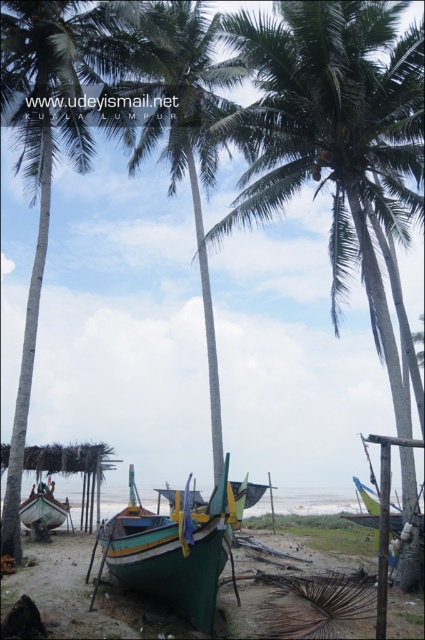
You are a photographer standing at the green leafy palm tree at center and want to take a photo of the green matte boat at center. If your camera can focus on objects up to 10 meters away, will you be able to capture the boat clearly?

The distance between the green leafy palm tree at center and the green matte boat at center is 9.79 meters, which is within the camera focus range of up to 10 meters. Therefore, you can capture the boat clearly.

You are an artist planning to paint this coastal scene. You want to ensure the green leafy coconut tree at center and the green fabric boat at lower right are proportionally accurate. Which object should you paint larger?

The green leafy coconut tree at center should be painted larger because it has a larger size compared to the green fabric boat at lower right.

You are standing at the center of the image and want to walk towards the green leafy palm tree at center. Which direction should you move in relation to the palm tree?

The green leafy palm tree at center is already at the center of the image, so you are already facing it directly. No need to move in any direction.